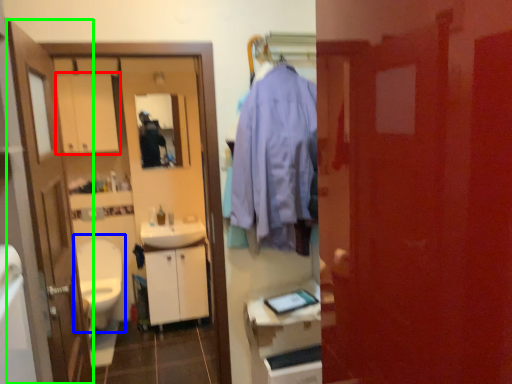
Question: Which object is positioned farthest from medicine cabinet (highlighted by a red box)? Select from toilet (highlighted by a blue box) and door (highlighted by a green box).

Choices:
 (A) toilet
 (B) door

Answer: (B)